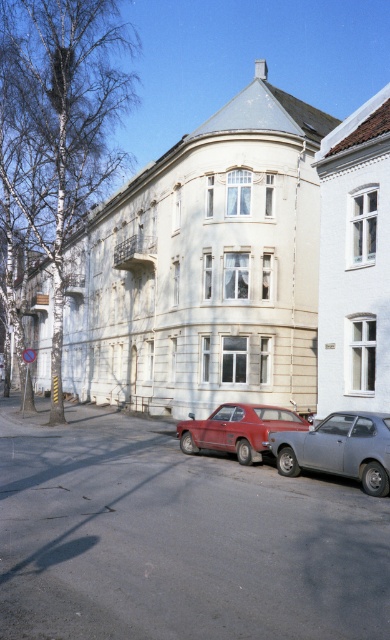
Can you confirm if matte gray hatchback at center is shorter than matte red station wagon at center?

No, matte gray hatchback at center is not shorter than matte red station wagon at center.

Is matte gray hatchback at center closer to camera compared to matte red station wagon at center?

Yes, it is in front of matte red station wagon at center.

The image size is (390, 640). I want to click on matte gray hatchback at center, so click(x=340, y=449).